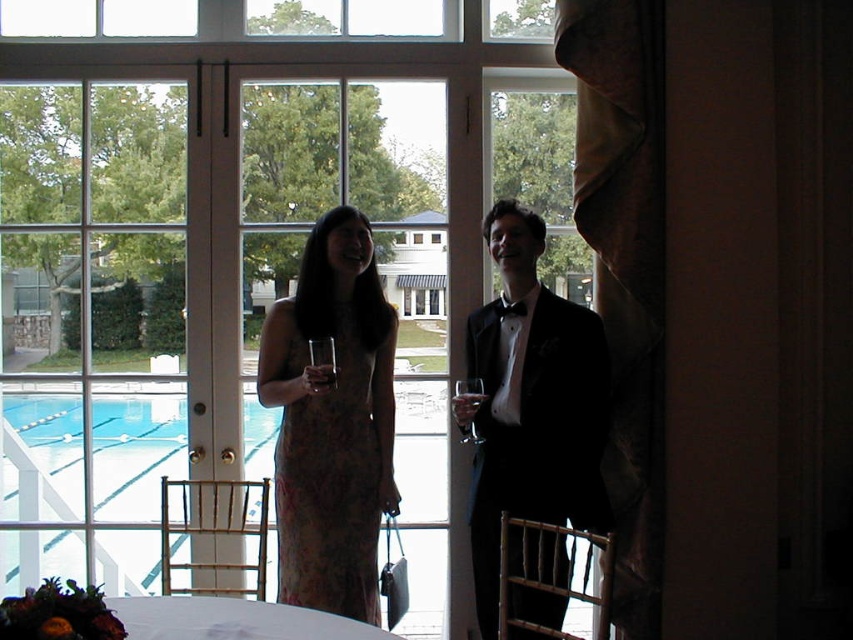
Can you confirm if matte floral dress at center is bigger than clear glass wine glass at center?

Correct, matte floral dress at center is larger in size than clear glass wine glass at center.

Based on the photo, which is more to the left, matte floral dress at center or clear glass wine glass at center?

clear glass wine glass at center is more to the left.

The image size is (853, 640). Describe the element at coordinates (332, 420) in the screenshot. I see `matte floral dress at center` at that location.

Locate an element on the screen. This screenshot has height=640, width=853. matte floral dress at center is located at coordinates (332, 420).

Can you confirm if matte floral dress at center is smaller than clear glass at center?

Actually, matte floral dress at center might be larger than clear glass at center.

I want to click on matte floral dress at center, so click(x=332, y=420).

Which of these two, clear glass at center or translucent glass wine at center, stands taller?

clear glass at center is taller.

Is clear glass at center positioned before translucent glass wine at center?

Yes.

The width and height of the screenshot is (853, 640). What do you see at coordinates (321, 376) in the screenshot? I see `clear glass at center` at bounding box center [321, 376].

Find the location of a particular element. This screenshot has width=853, height=640. clear glass at center is located at coordinates (321, 376).